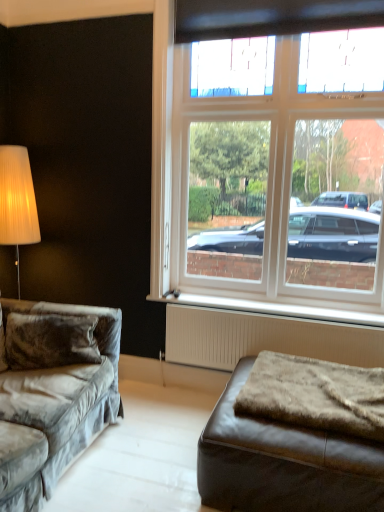
Question: Does velvet gray couch at left have a lesser height compared to fuzzy brown blanket at lower right?

Choices:
 (A) yes
 (B) no

Answer: (B)

Question: Does velvet gray couch at left touch fuzzy brown blanket at lower right?

Choices:
 (A) no
 (B) yes

Answer: (A)

Question: Is velvet gray couch at left positioned far away from fuzzy brown blanket at lower right?

Choices:
 (A) yes
 (B) no

Answer: (B)

Question: Considering the relative sizes of velvet gray couch at left and fuzzy brown blanket at lower right in the image provided, is velvet gray couch at left smaller than fuzzy brown blanket at lower right?

Choices:
 (A) yes
 (B) no

Answer: (B)

Question: From a real-world perspective, is velvet gray couch at left under fuzzy brown blanket at lower right?

Choices:
 (A) yes
 (B) no

Answer: (A)

Question: Based on their sizes in the image, would you say white textured radiator at lower center is bigger or smaller than fuzzy brown blanket at lower right?

Choices:
 (A) big
 (B) small

Answer: (A)

Question: Do you think white textured radiator at lower center is within fuzzy brown blanket at lower right, or outside of it?

Choices:
 (A) inside
 (B) outside

Answer: (B)

Question: Is point (355, 351) closer or farther from the camera than point (354, 398)?

Choices:
 (A) farther
 (B) closer

Answer: (A)

Question: Considering the positions of white textured radiator at lower center and fuzzy brown blanket at lower right in the image, is white textured radiator at lower center taller or shorter than fuzzy brown blanket at lower right?

Choices:
 (A) tall
 (B) short

Answer: (A)

Question: Is point (23, 460) closer or farther from the camera than point (266, 302)?

Choices:
 (A) farther
 (B) closer

Answer: (B)

Question: In terms of width, does velvet gray couch at left look wider or thinner when compared to white plastic radiator at lower center?

Choices:
 (A) wide
 (B) thin

Answer: (A)

Question: From a real-world perspective, is velvet gray couch at left positioned above or below white plastic radiator at lower center?

Choices:
 (A) below
 (B) above

Answer: (A)

Question: Relative to white plastic radiator at lower center, is velvet gray couch at left in front or behind?

Choices:
 (A) behind
 (B) front

Answer: (B)

Question: From the image's perspective, is brown leather ottoman at lower right located above or below velvet gray couch at left?

Choices:
 (A) above
 (B) below

Answer: (B)

Question: Based on their sizes in the image, would you say brown leather ottoman at lower right is bigger or smaller than velvet gray couch at left?

Choices:
 (A) small
 (B) big

Answer: (A)